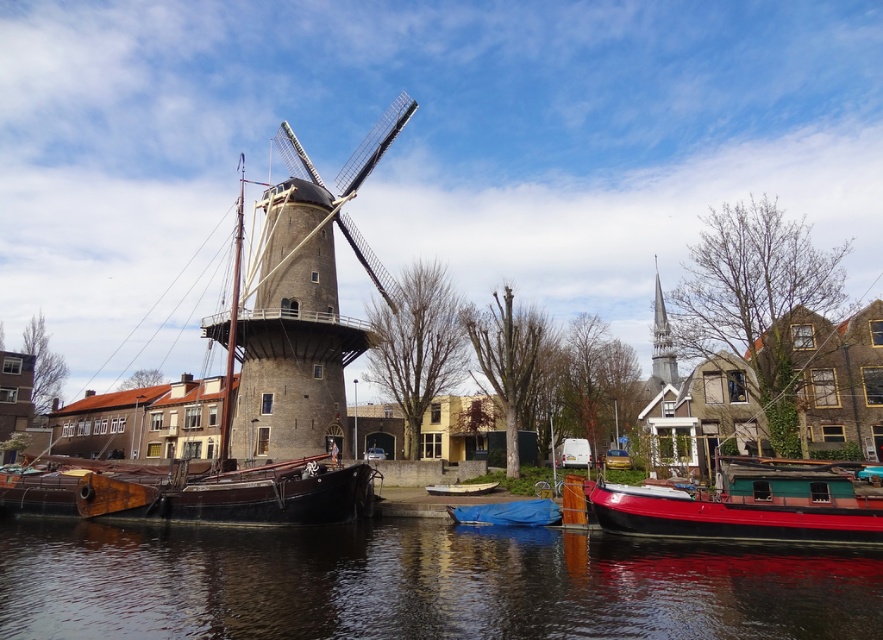
From the picture: You are a tourist standing at the edge of the canal near the windmill. You want to take a photo of the shiny red boat at lower right but also want to include as much of the smooth water at lower center as possible. Which direction should you move to capture both in the frame?

You should move to the left to capture both the shiny red boat at lower right and more of the smooth water at lower center, since the smooth water at lower center is wider than the shiny red boat at lower right.